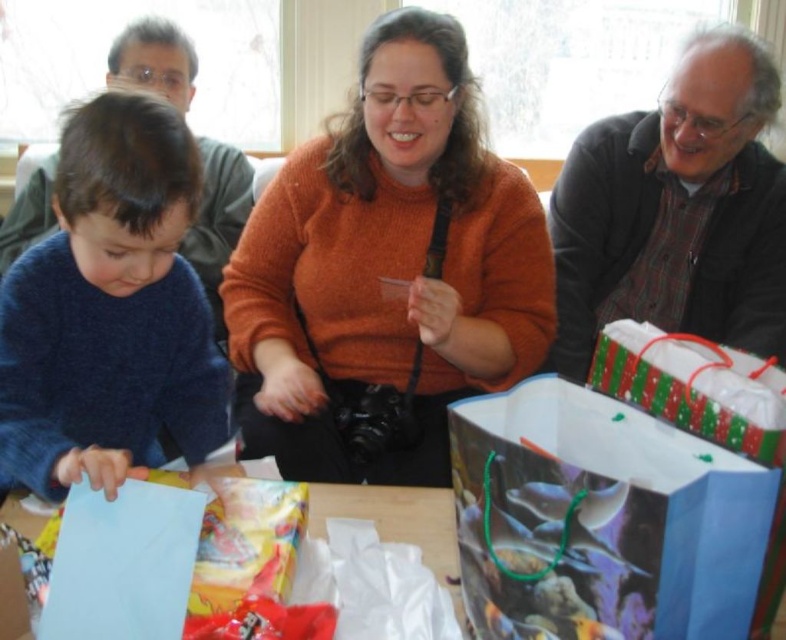
Question: Considering the real-world distances, which object is farthest from the orange sweater at center?

Choices:
 (A) blue paper at lower left
 (B) plaid flannel shirt at right

Answer: (B)

Question: Observing the image, what is the correct spatial positioning of multicolored paper bag at lower right in reference to green and white paper gift bag at right?

Choices:
 (A) below
 (B) above

Answer: (A)

Question: Among these points, which one is farthest from the camera?

Choices:
 (A) (753, 234)
 (B) (28, 179)

Answer: (B)

Question: Is plaid flannel shirt at right above green and white paper gift bag at right?

Choices:
 (A) yes
 (B) no

Answer: (A)

Question: Estimate the real-world distances between objects in this image. Which object is closer to the multicolored paper bag at lower right?

Choices:
 (A) blue paper at lower left
 (B) matte gray sweater at left

Answer: (A)

Question: Does orange sweater at center appear on the left side of green and white paper gift bag at right?

Choices:
 (A) yes
 (B) no

Answer: (A)